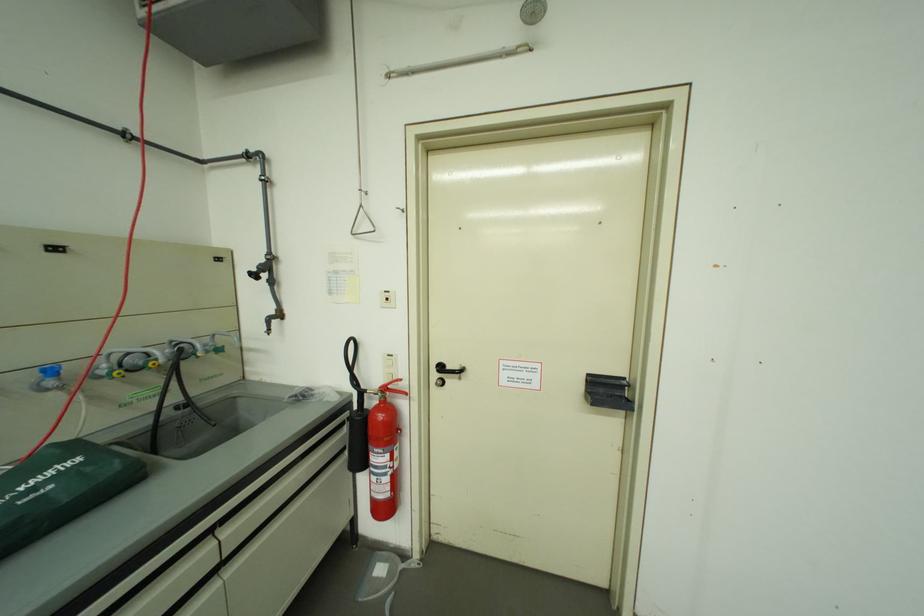
The height and width of the screenshot is (616, 924). What are the coordinates of `triangular pull handle` in the screenshot? It's located at (608, 392).